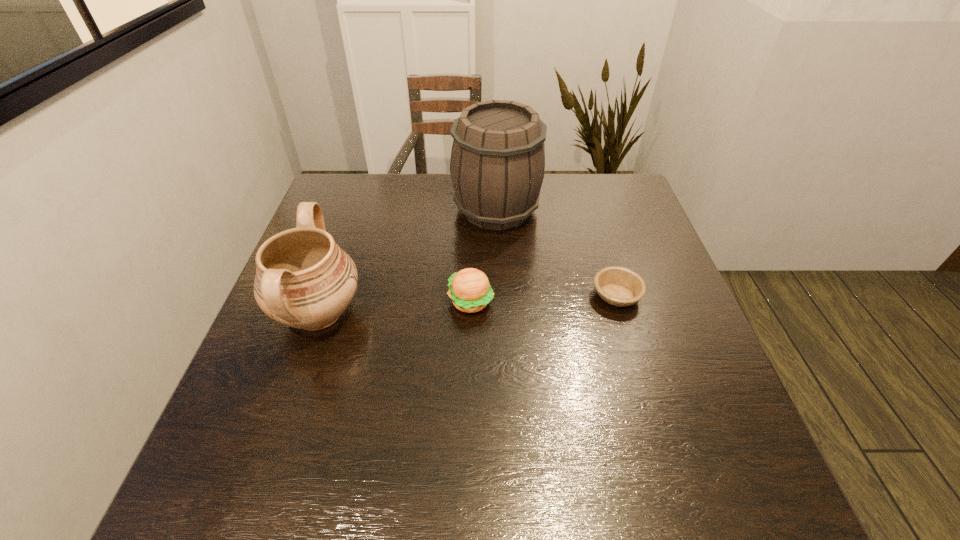
Locate an element on the screen. The height and width of the screenshot is (540, 960). free space located on the front of the shortest object is located at coordinates (630, 339).

Identify the location of object that is at the far edge. (497, 165).

This screenshot has height=540, width=960. What are the coordinates of `object that is at the left edge` in the screenshot? It's located at (304, 280).

Identify the location of object that is at the right edge. (618, 286).

Find the location of a particular element. vacant area at the far edge is located at coordinates coord(574,194).

In the image, there is a desktop. In order to click on vacant space at the near edge in this screenshot , I will do `click(317, 474)`.

The height and width of the screenshot is (540, 960). In order to click on vacant region at the left edge of the desktop in this screenshot , I will do `click(236, 429)`.

This screenshot has height=540, width=960. Identify the location of free space at the right edge of the desktop. pos(618,235).

Locate an element on the screen. The height and width of the screenshot is (540, 960). vacant space at the far left corner is located at coordinates (348, 177).

You are a GUI agent. You are given a task and a screenshot of the screen. Output one action in this format:
    pyautogui.click(x=<x>, y=<y>)
    Task: Click on the blank space at the near left corner of the desktop
    The image size is (960, 540).
    Given the screenshot: What is the action you would take?
    pyautogui.click(x=191, y=485)